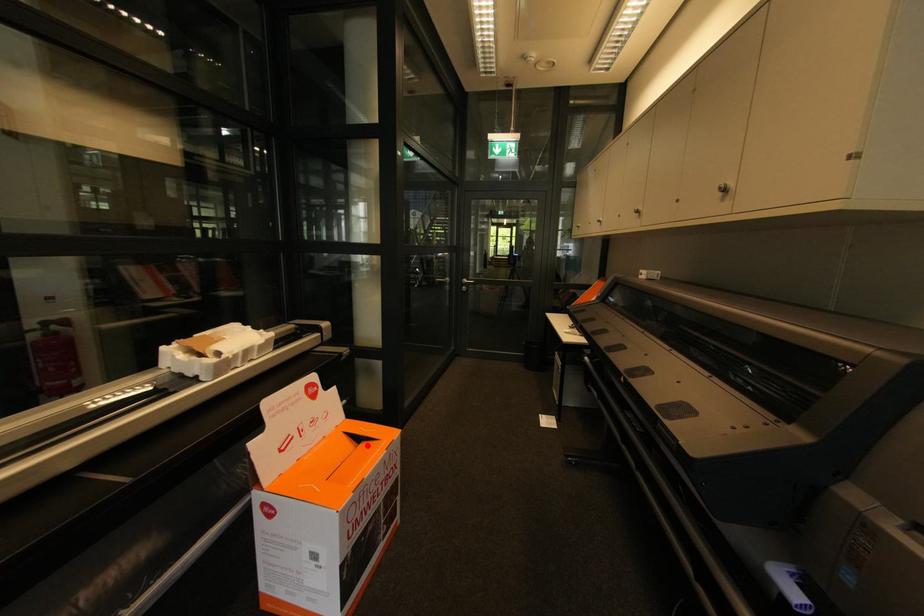
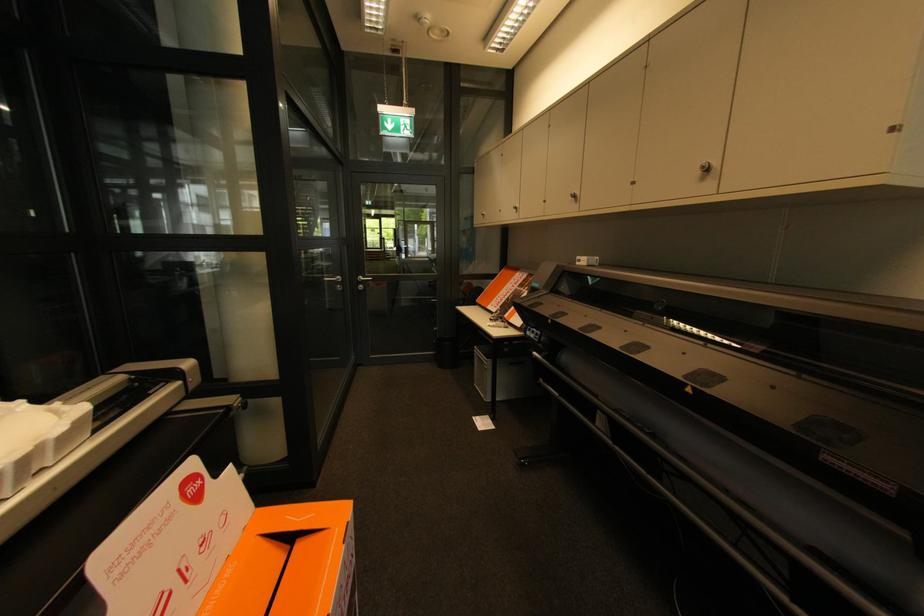
Question: I am providing you with two images of the same scene from different viewpoints. In image1, a red point is highlighted. Considering the same 3D point in image2, which of the following is correct?

Choices:
 (A) It is closer
 (B) It is farther

Answer: (B)